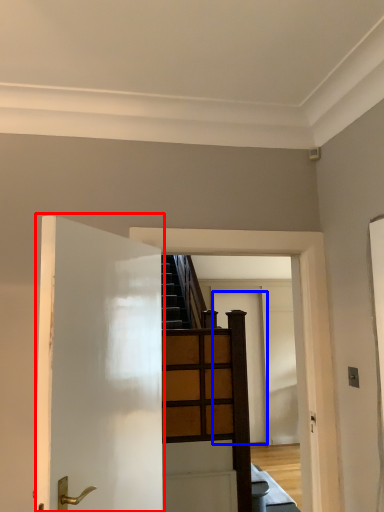
Question: Which point is closer to the camera, door (highlighted by a red box) or door (highlighted by a blue box)?

Choices:
 (A) door
 (B) door

Answer: (A)